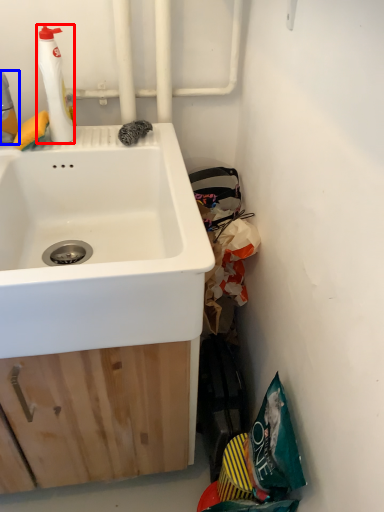
Question: Among these objects, which one is farthest to the camera, cleaning product (highlighted by a red box) or cleaning product (highlighted by a blue box)?

Choices:
 (A) cleaning product
 (B) cleaning product

Answer: (A)